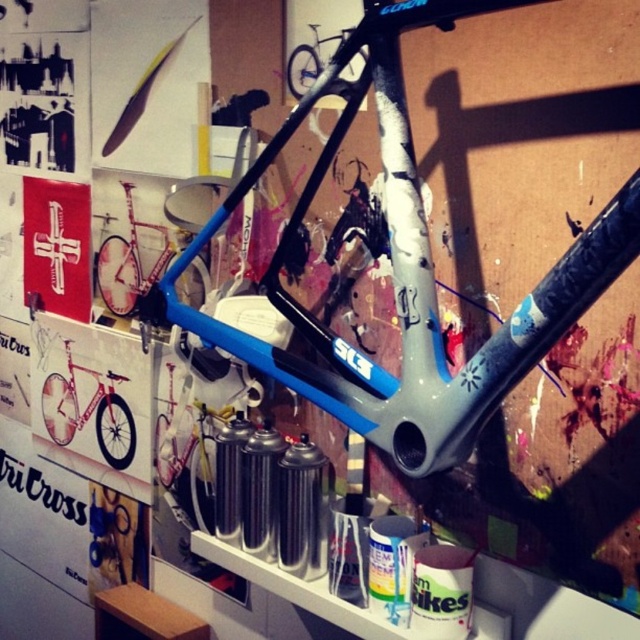
Question: Which of the following is the farthest from the observer?

Choices:
 (A) shiny silver bicycle at upper center
 (B) shiny red bicycle at left

Answer: (B)

Question: Which point is farther to the camera?

Choices:
 (A) (289, 80)
 (B) (128, 182)

Answer: (B)

Question: Can you confirm if shiny red bicycle at left is positioned to the right of matte blue frame at center?

Choices:
 (A) yes
 (B) no

Answer: (B)

Question: Does matte blue frame at center have a greater width compared to shiny silver bicycle at upper center?

Choices:
 (A) no
 (B) yes

Answer: (B)

Question: Which point is farther to the camera?

Choices:
 (A) (288, 60)
 (B) (161, 260)
 (C) (67, 371)

Answer: (C)

Question: Does shiny red bicycle at left have a lesser width compared to shiny silver bicycle at upper center?

Choices:
 (A) yes
 (B) no

Answer: (B)